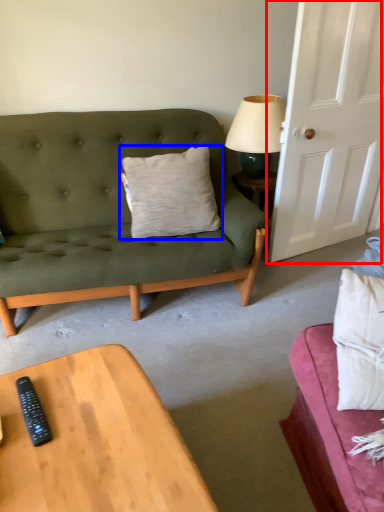
Question: Which of the following is the farthest to the observer, door (highlighted by a red box) or pillow (highlighted by a blue box)?

Choices:
 (A) door
 (B) pillow

Answer: (B)